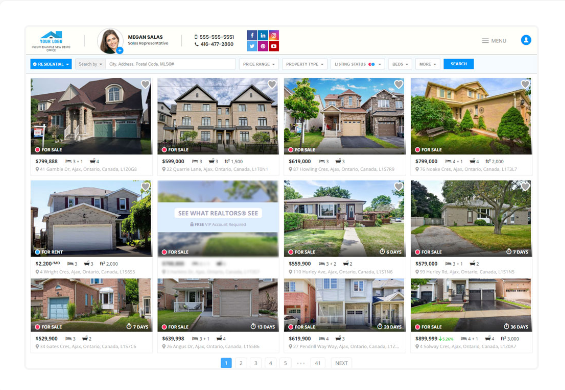
Where is `walk way`? This screenshot has width=565, height=390. walk way is located at coordinates (356, 245), (110, 317).